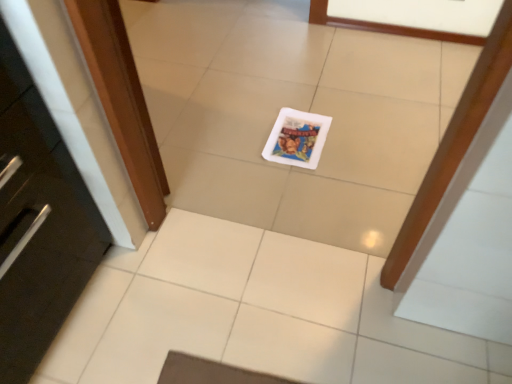
Locate an element on the screen. This screenshot has width=512, height=384. free point above white matte postcard at center (from a real-world perspective) is located at coordinates (298, 135).